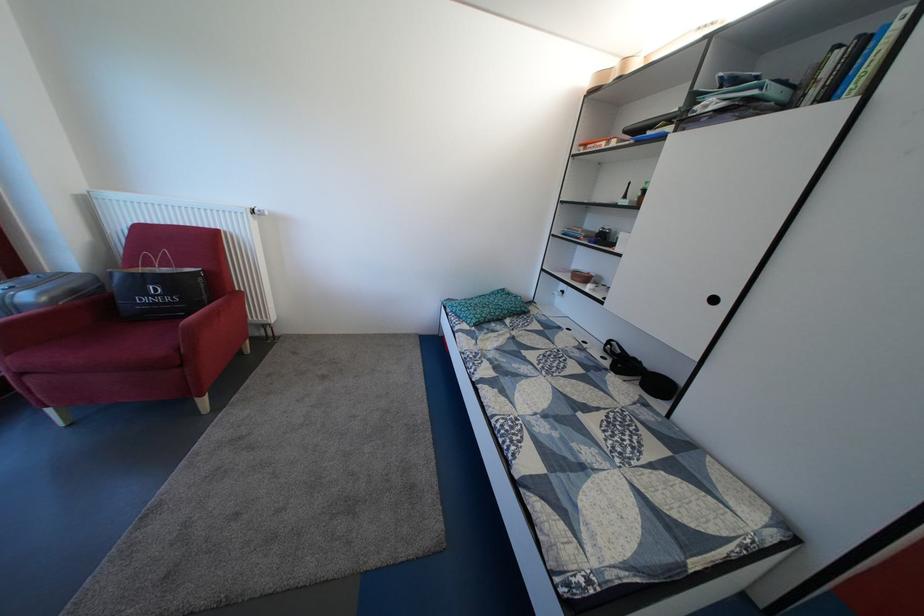
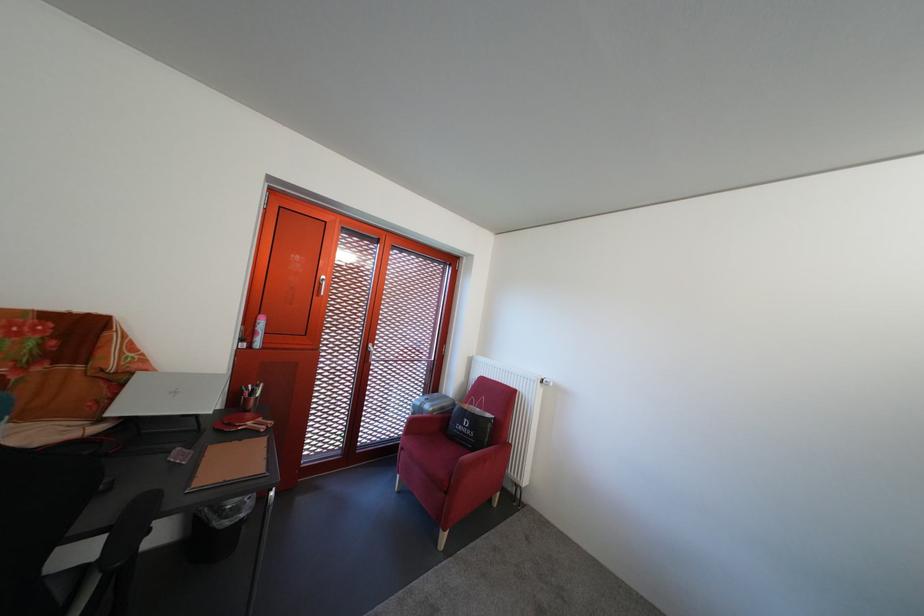
In the second image, find the point that corresponds to the point at 39,304 in the first image.

(439, 413)